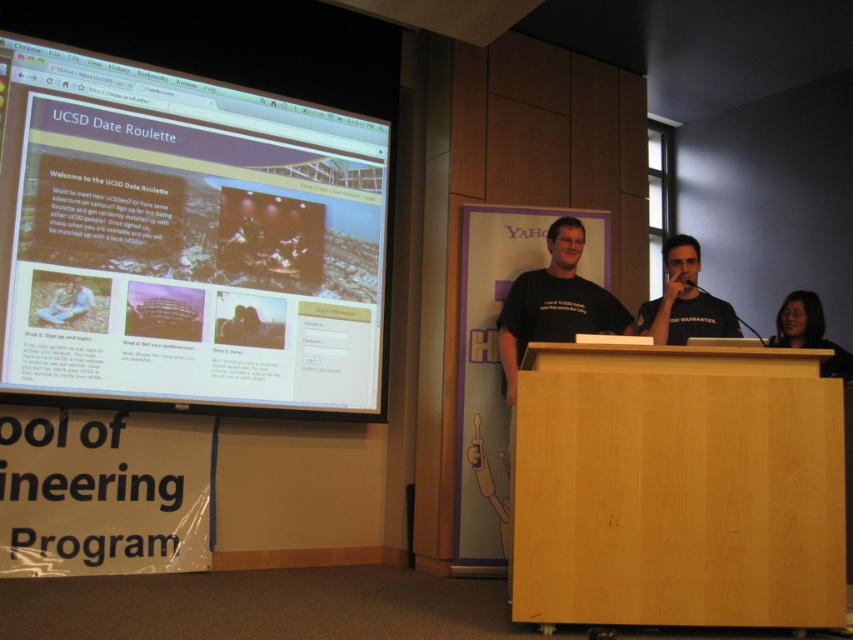
You are a photographer in the back of the room. You want to take a photo of the black matte shirt at center and the matte black hair at lower right. Which one will appear taller in the photo?

The black matte shirt at center will appear taller in the photo because it is taller than the matte black hair at lower right according to the description.

You are an attendee at the presentation and want to locate the speaker wearing the black matte shirt at center. Where should you look on the screen?

The speaker wearing the black matte shirt at center is located at point 0.470 on the x axis and 0.803 on the y axis.